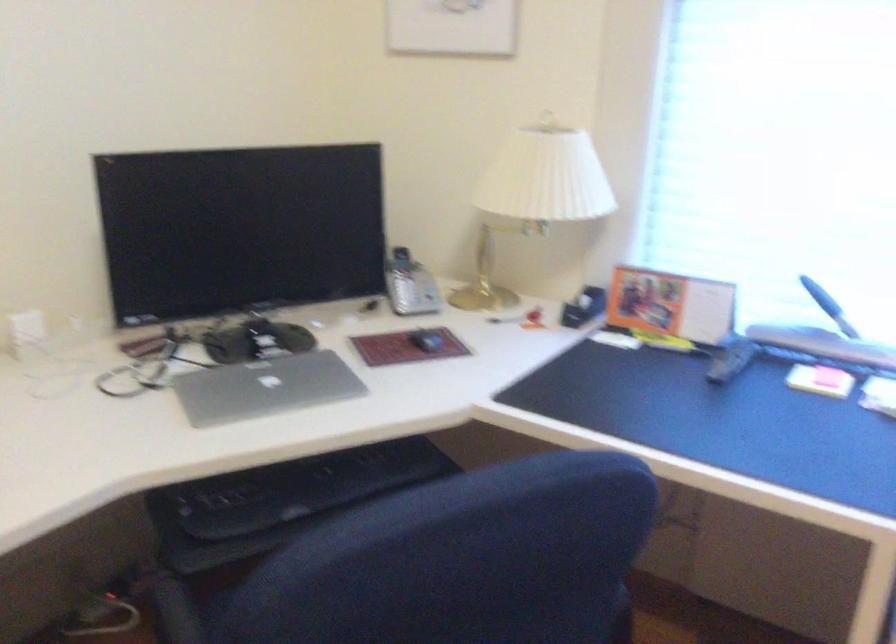
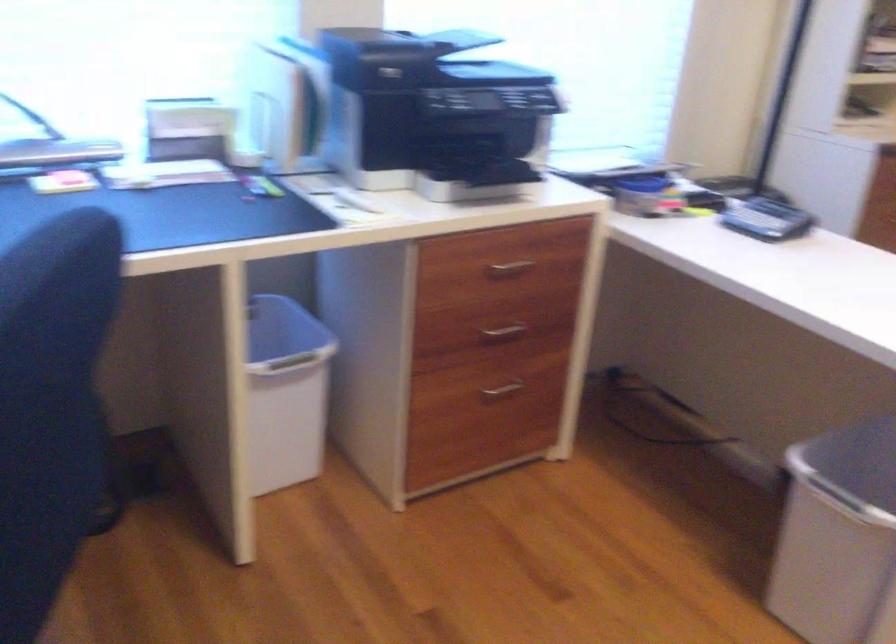
The images are taken continuously from a first-person perspective. In which direction is your viewpoint rotating?

The camera rotated toward right-down.